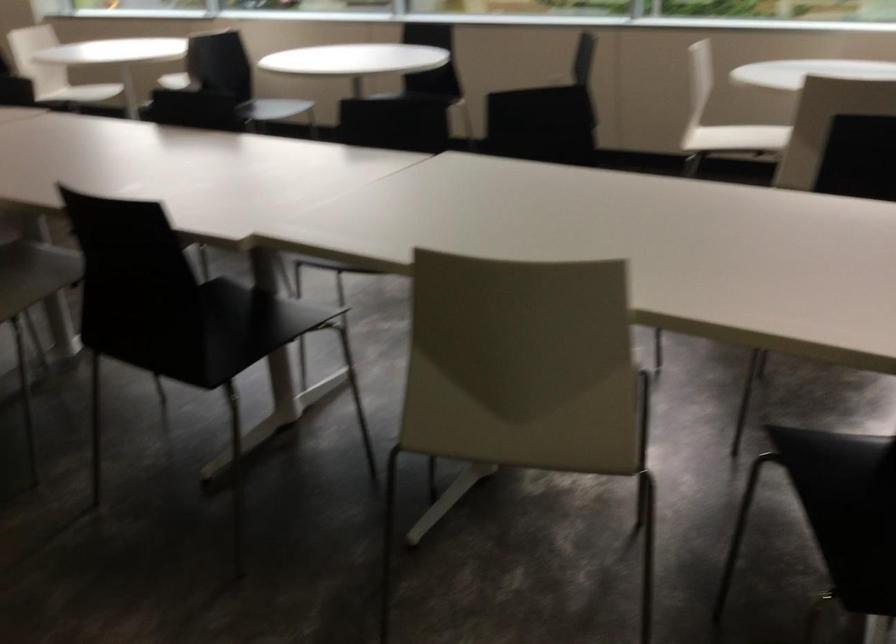
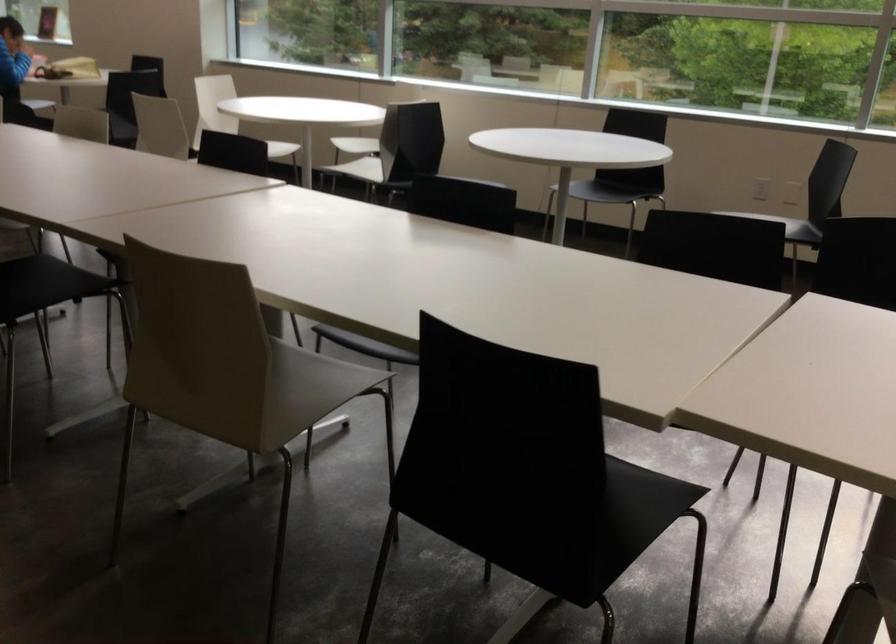
Question: The camera is either moving clockwise (left) or counter-clockwise (right) around the object. The first image is from the beginning of the video and the second image is from the end. Is the camera moving left or right when shooting the video?

Choices:
 (A) Left
 (B) Right

Answer: (B)